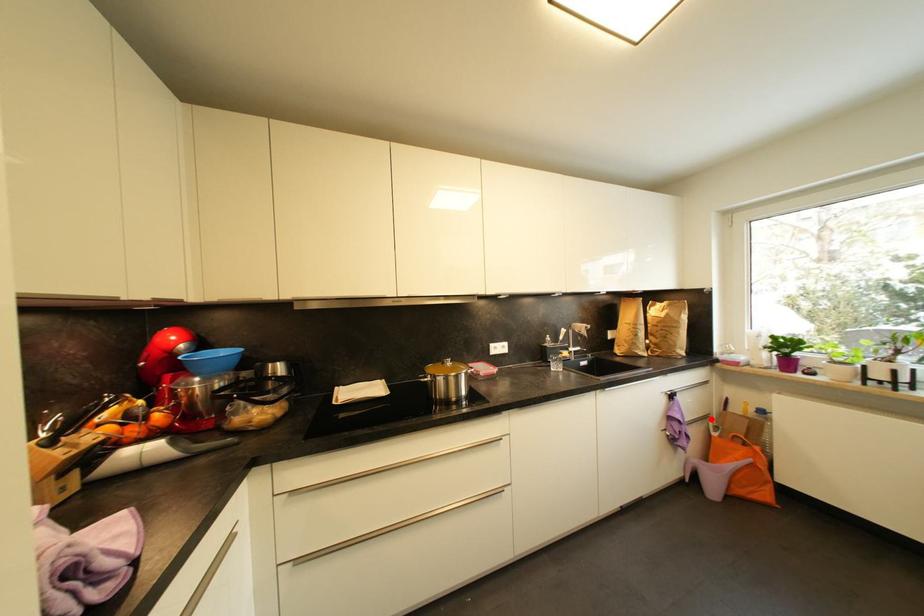
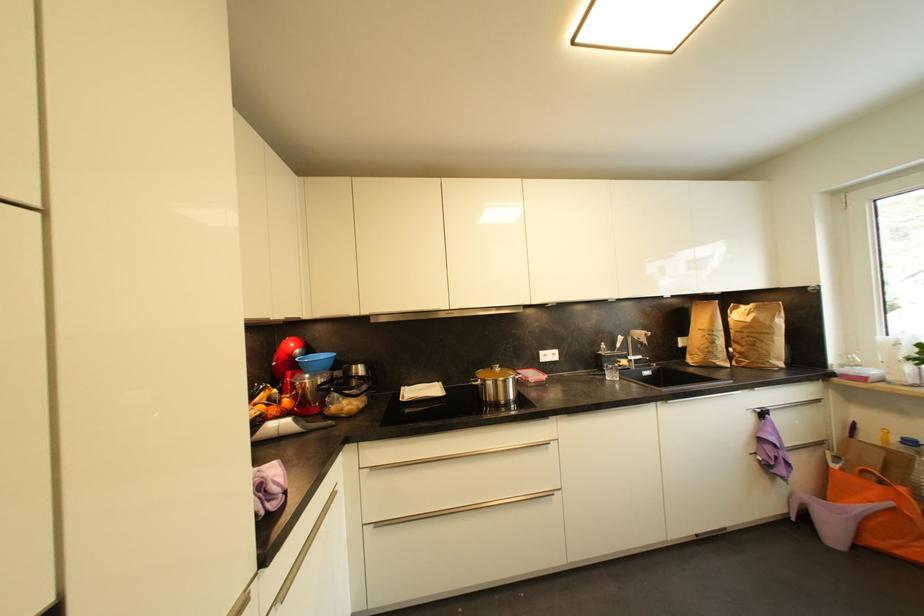
Question: A red point is marked in image1. In image2, is the corresponding 3D point closer to the camera or farther? Reply with the corresponding letter.

Choices:
 (A) The corresponding 3D point is closer.
 (B) The corresponding 3D point is farther.

Answer: (A)